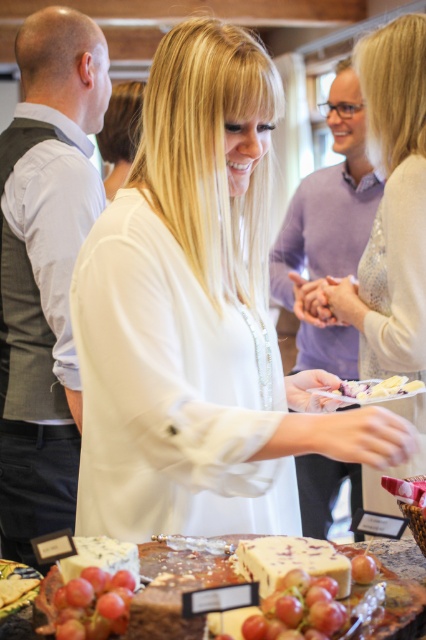
Question: Among these points, which one is farthest from the camera?

Choices:
 (A) (85, 588)
 (B) (370, 579)
 (C) (339, 240)
 (D) (394, 380)

Answer: (C)

Question: Which point is farther to the camera?

Choices:
 (A) (350, 358)
 (B) (88, 577)

Answer: (A)

Question: Can you confirm if ripe red grapes at lower center is positioned to the left of smooth wooden table at center?

Choices:
 (A) no
 (B) yes

Answer: (B)

Question: Does white matte shirt at center appear over smooth wooden table at center?

Choices:
 (A) no
 (B) yes

Answer: (B)

Question: Which point appears closest to the camera in this image?

Choices:
 (A) (360, 573)
 (B) (108, 586)

Answer: (B)

Question: Is ripe red grapes at lower center below purple glossy grapes at lower left?

Choices:
 (A) no
 (B) yes

Answer: (A)